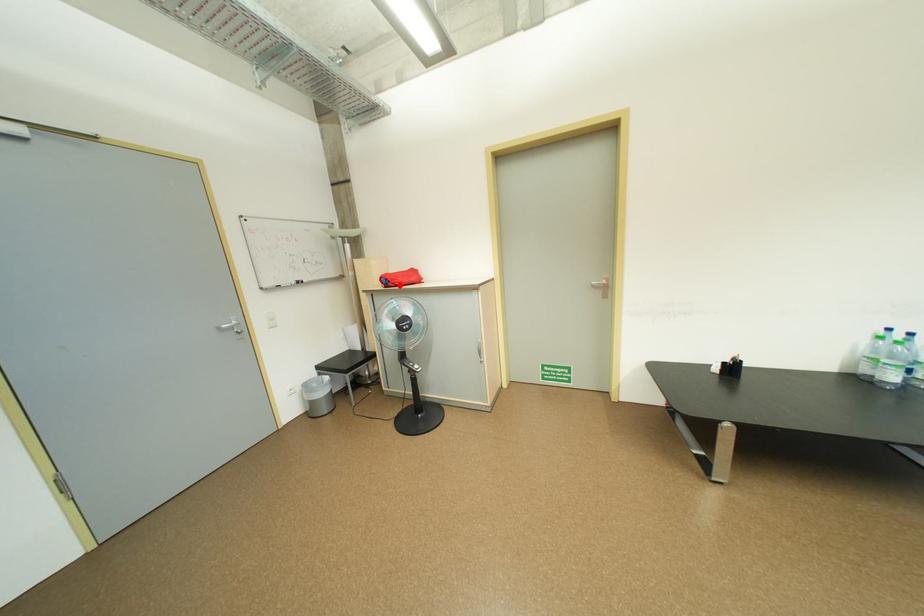
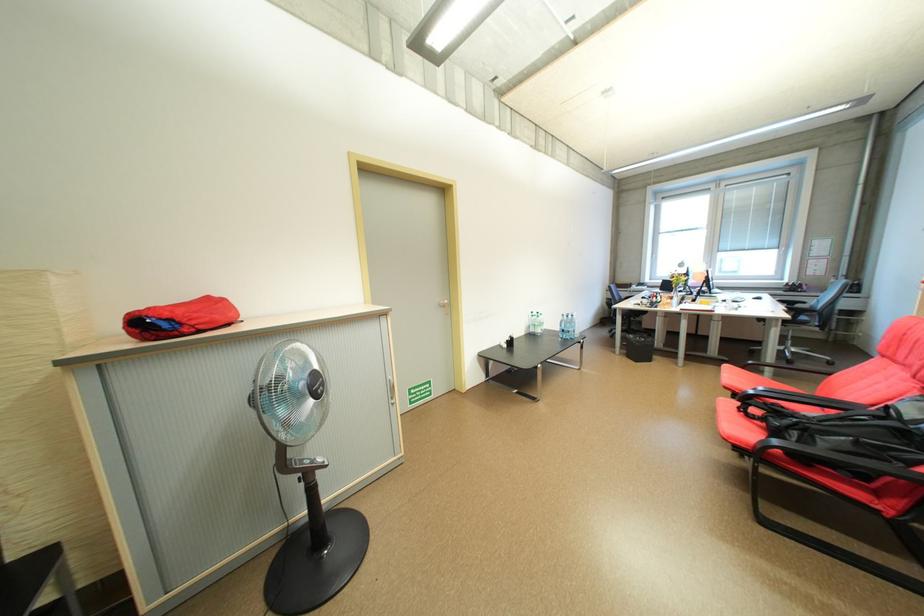
Find the pixel in the second image that matches the highlighted location in the first image.

(196, 331)